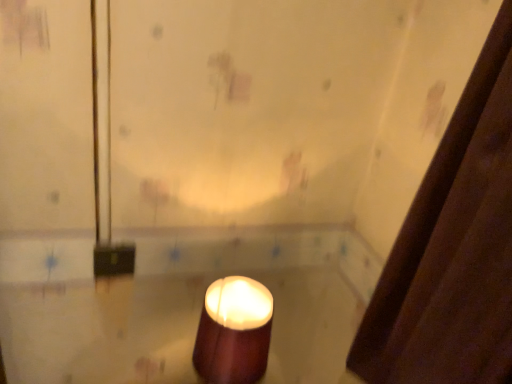
Question: From a real-world perspective, is matte brown candle at center physically located above or below brown fabric shower curtain at right?

Choices:
 (A) above
 (B) below

Answer: (B)

Question: In terms of size, does matte brown candle at center appear bigger or smaller than brown fabric shower curtain at right?

Choices:
 (A) small
 (B) big

Answer: (A)

Question: Relative to brown fabric shower curtain at right, is matte brown candle at center in front or behind?

Choices:
 (A) front
 (B) behind

Answer: (B)

Question: Is brown fabric shower curtain at right inside or outside of matte brown candle at center?

Choices:
 (A) outside
 (B) inside

Answer: (A)

Question: From the image's perspective, is brown fabric shower curtain at right above or below matte brown candle at center?

Choices:
 (A) below
 (B) above

Answer: (B)

Question: Does point (384, 339) appear closer or farther from the camera than point (239, 307)?

Choices:
 (A) farther
 (B) closer

Answer: (B)

Question: Visually, is brown fabric shower curtain at right positioned to the left or to the right of matte brown candle at center?

Choices:
 (A) right
 (B) left

Answer: (A)